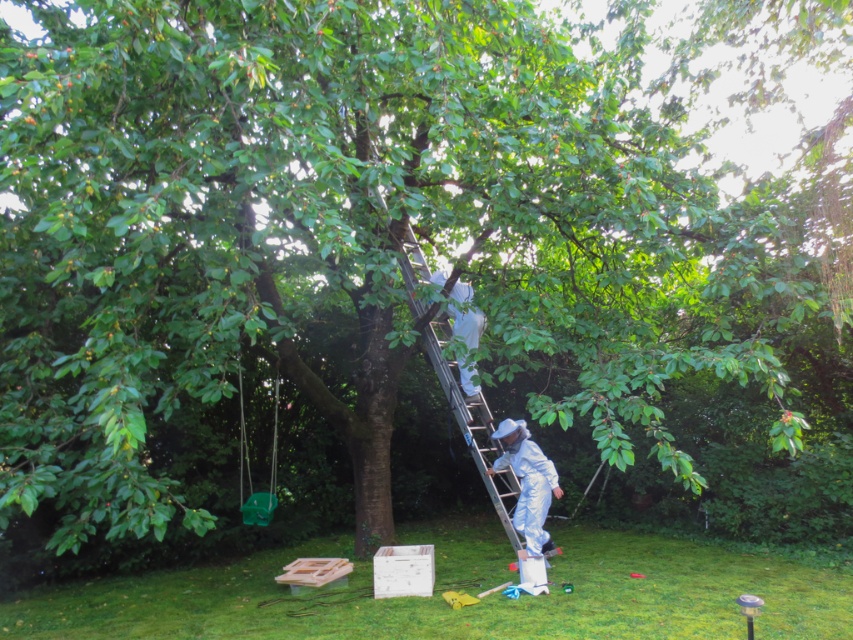
You are a painter needing to climb the silver metallic ladder at center to reach the tree canopy. However, you are wearing the white fabric beekeeper suit at center. Considering their widths, will the ladder be wide enough for you to climb safely?

The silver metallic ladder at center is wider than the white fabric beekeeper suit at center, so it should be wide enough for safe climbing.

You are planning to hang a new decoration between the white fabric at upper center and the green plastic swing at lower left. Based on their sizes, which object should you place higher to ensure the decoration is balanced?

The white fabric at upper center is shorter than the green plastic swing at lower left, so you should place the decoration higher on the green plastic swing at lower left to balance their sizes.